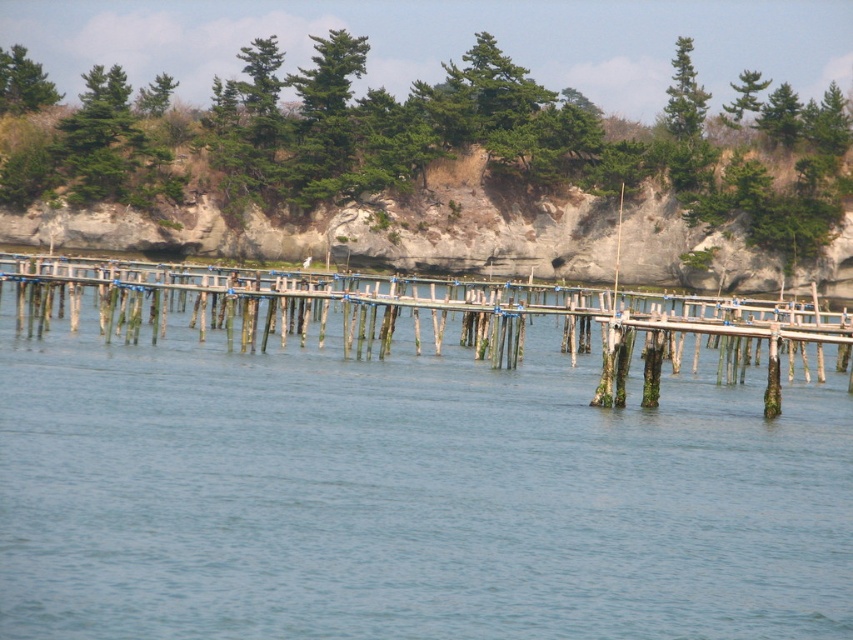
What do you see at coordinates (395, 472) in the screenshot?
I see `clear blue water at center` at bounding box center [395, 472].

Is clear blue water at center positioned in front of rocky cliff at upper center?

Yes, it is.

Find the location of a particular element. The height and width of the screenshot is (640, 853). clear blue water at center is located at coordinates (x=395, y=472).

At what (x,y) coordinates should I click in order to perform the action: click on clear blue water at center. Please return your answer as a coordinate pair (x, y). Looking at the image, I should click on (395, 472).

In order to click on rocky cliff at upper center in this screenshot , I will do `click(358, 227)`.

Looking at this image, between rocky cliff at upper center and wooden dock at center, which one has less height?

wooden dock at center is shorter.

The width and height of the screenshot is (853, 640). Identify the location of rocky cliff at upper center. coord(358,227).

Where is `rocky cliff at upper center`? The image size is (853, 640). rocky cliff at upper center is located at coordinates (358, 227).

Can you confirm if clear blue water at center is shorter than wooden dock at center?

Incorrect, clear blue water at center's height does not fall short of wooden dock at center's.

Which is in front, point (439, 432) or point (554, 292)?

Positioned in front is point (439, 432).

Between point (357, 401) and point (358, 356), which one is positioned behind?

The point (358, 356) is behind.

This screenshot has height=640, width=853. I want to click on clear blue water at center, so click(x=395, y=472).